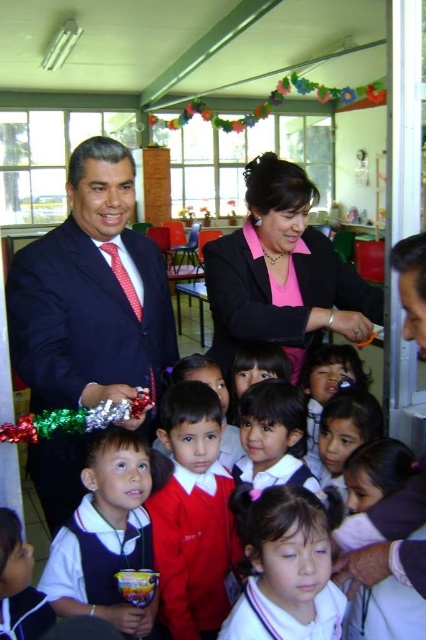
You are standing in the classroom and notice a red smooth shirt at center. Can you determine its exact position using the coordinate system provided?

The red smooth shirt at center is located at point (192, 515) in the coordinate system.

You are a photographer setting up for a group photo in the classroom. You need to ensure that the white matte uniform at center and the red dotted tie at left are both visible in the frame. Given their sizes, which object should you focus on to capture both effectively?

The white matte uniform at center has a larger width than the red dotted tie at left, so focusing on the white matte uniform at center would ensure both are visible in the frame since it occupies more space.